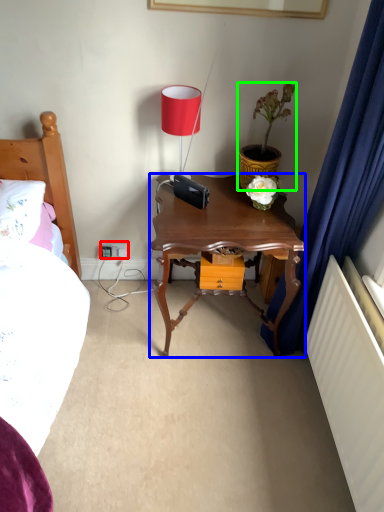
Question: Which object is the closest to the electric outlet (highlighted by a red box)? Choose among these: nightstand (highlighted by a blue box) or houseplant (highlighted by a green box).

Choices:
 (A) nightstand
 (B) houseplant

Answer: (A)